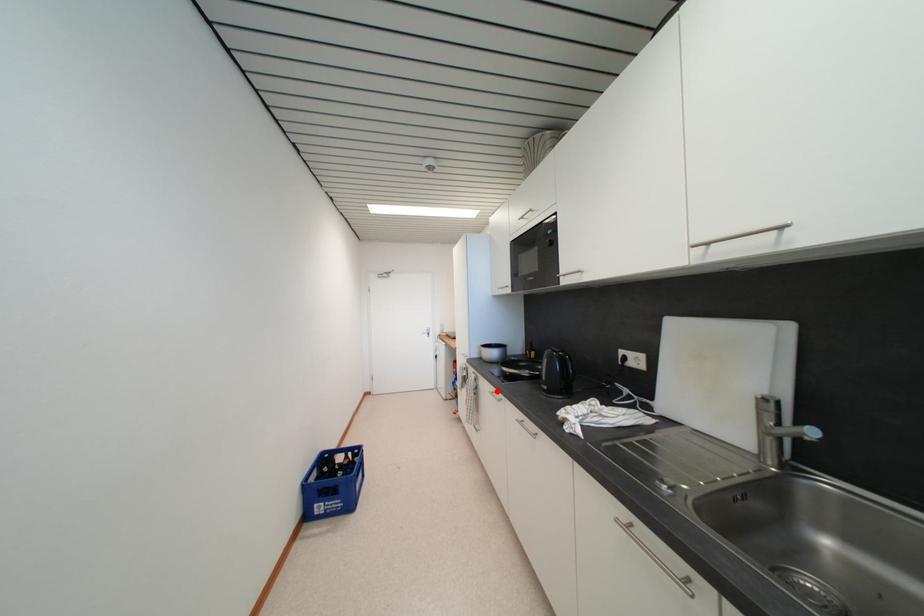
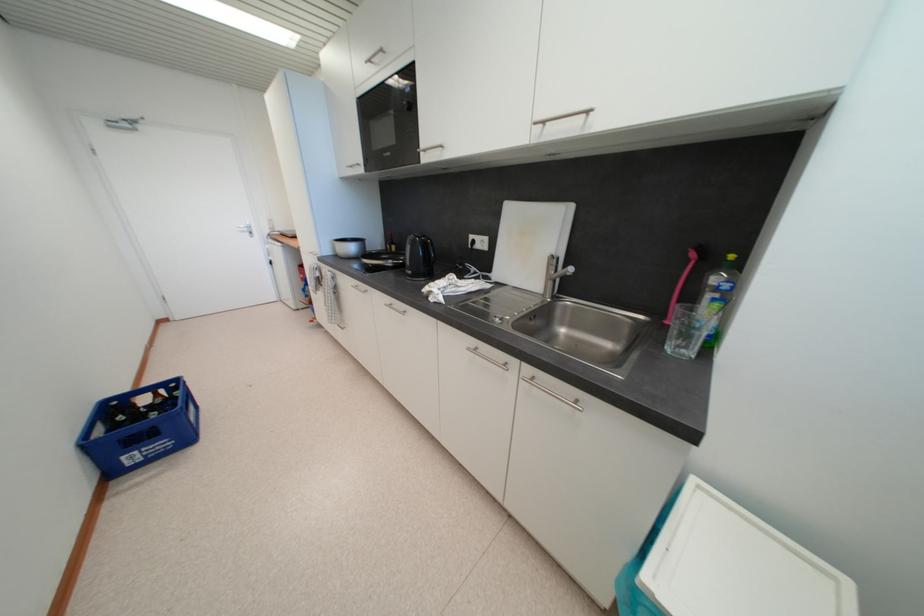
Find the pixel in the second image that matches the highlighted location in the first image.

(359, 285)